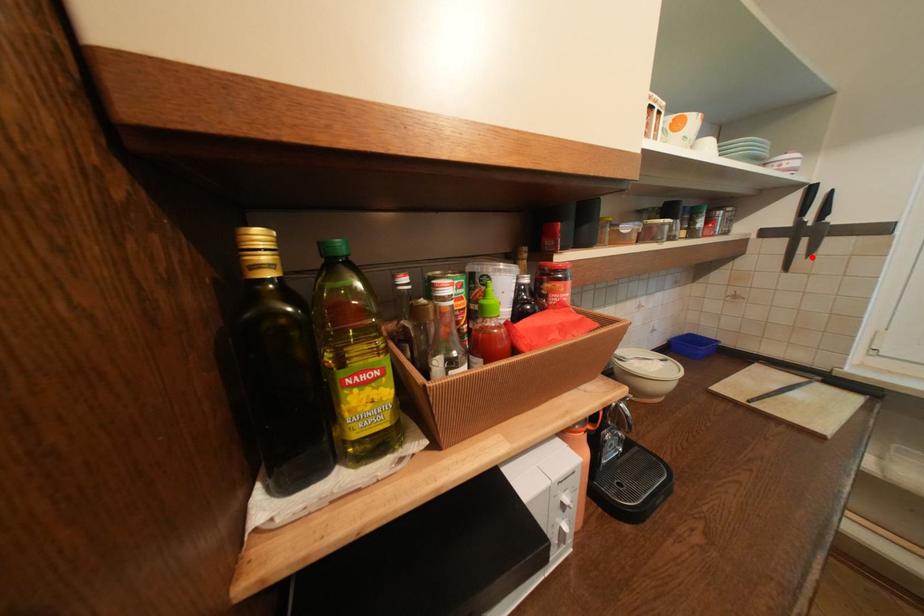
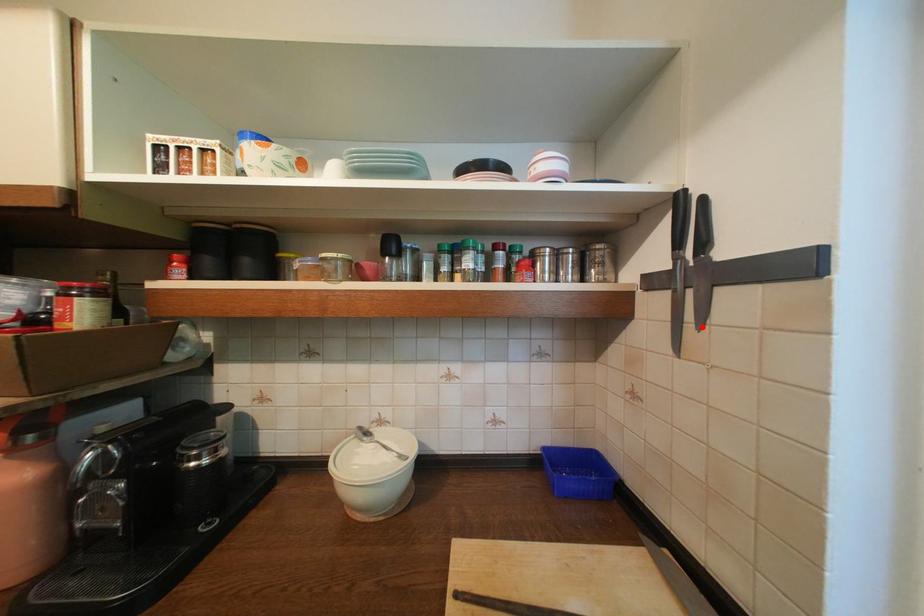
I am providing you with two images of the same scene from different viewpoints. A red point is marked on the first image and another point is marked on the second image. Is the marked point in image1 the same physical position as the marked point in image2?

Yes